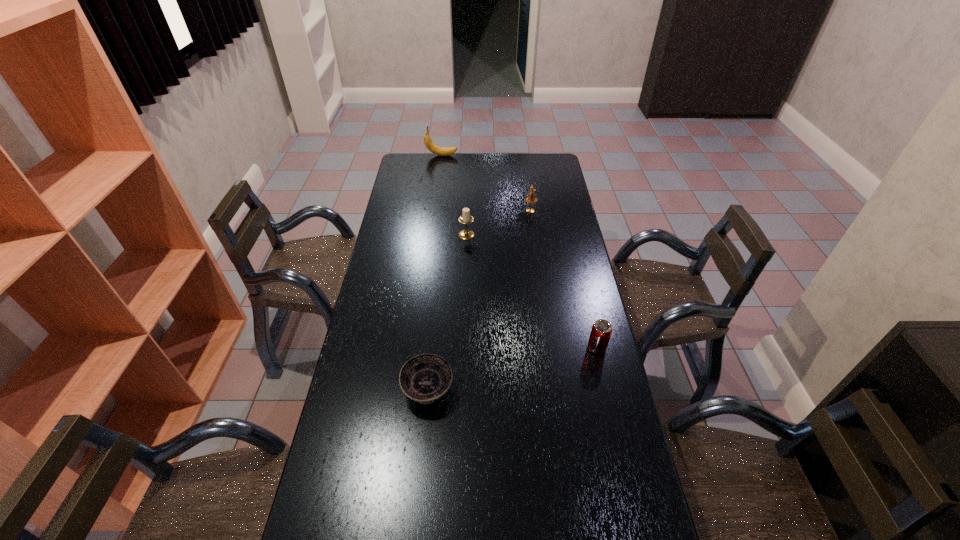
I want to click on vacant region that satisfies the following two spatial constraints: 1. at the start of the peel on the tallest object; 2. on the right side of the farther candle holder, so click(435, 211).

Where is `vacant point that satisfies the following two spatial constraints: 1. at the start of the peel on the tallest object; 2. on the right side of the third farthest object`? This screenshot has height=540, width=960. vacant point that satisfies the following two spatial constraints: 1. at the start of the peel on the tallest object; 2. on the right side of the third farthest object is located at coordinates (431, 235).

Find the location of a particular element. free point that satisfies the following two spatial constraints: 1. at the start of the peel on the bowl; 2. on the right side of the banana is located at coordinates pyautogui.click(x=412, y=390).